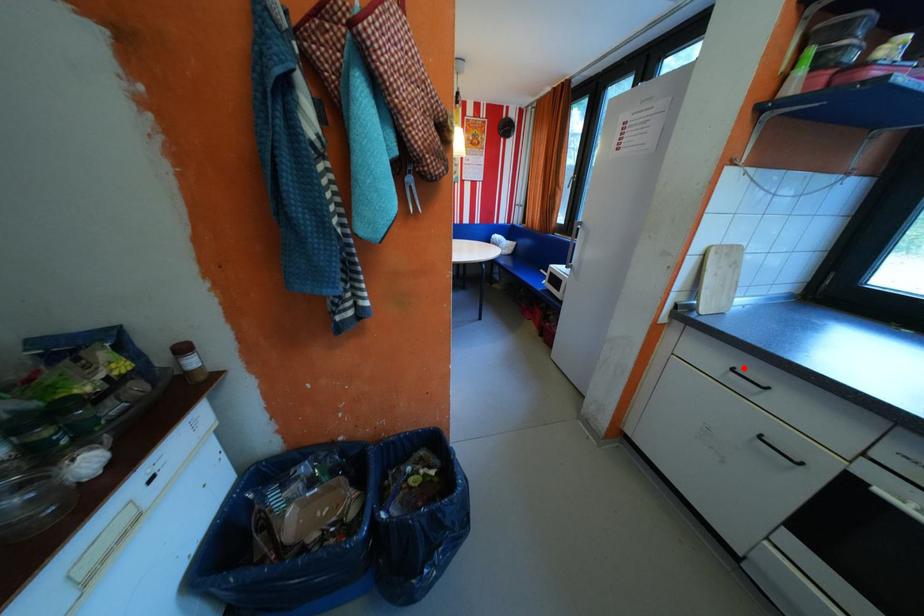
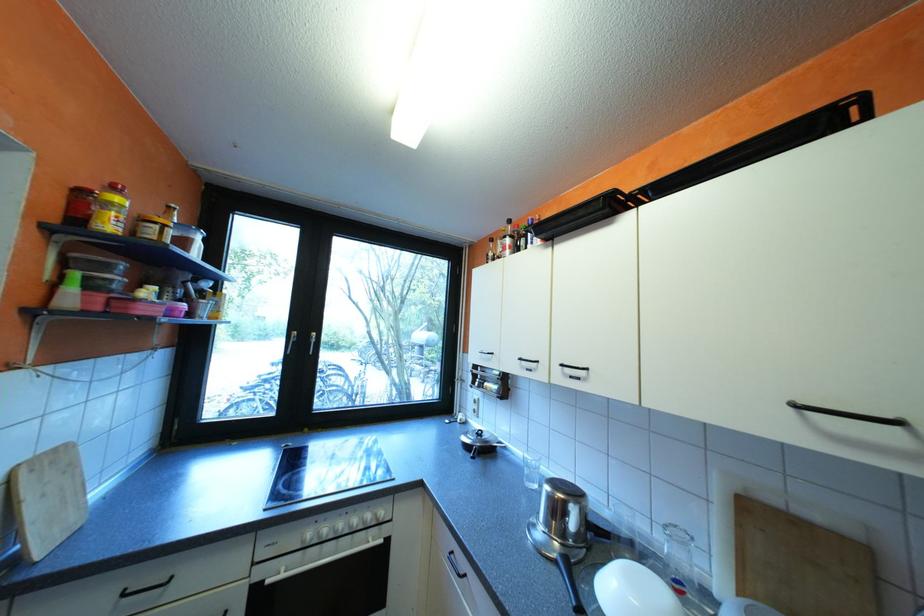
Where in the second image is the point corresponding to the highlighted location from the first image?

(136, 593)